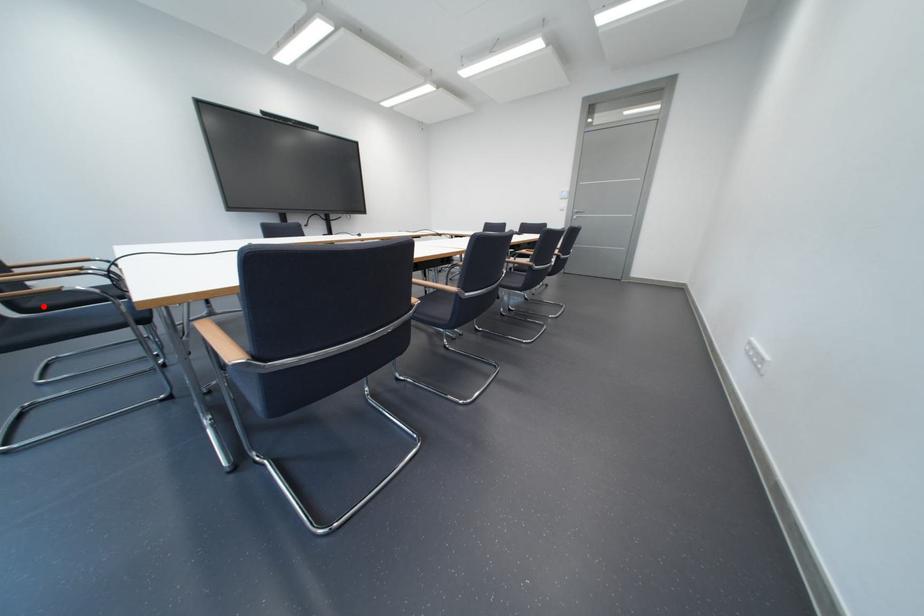
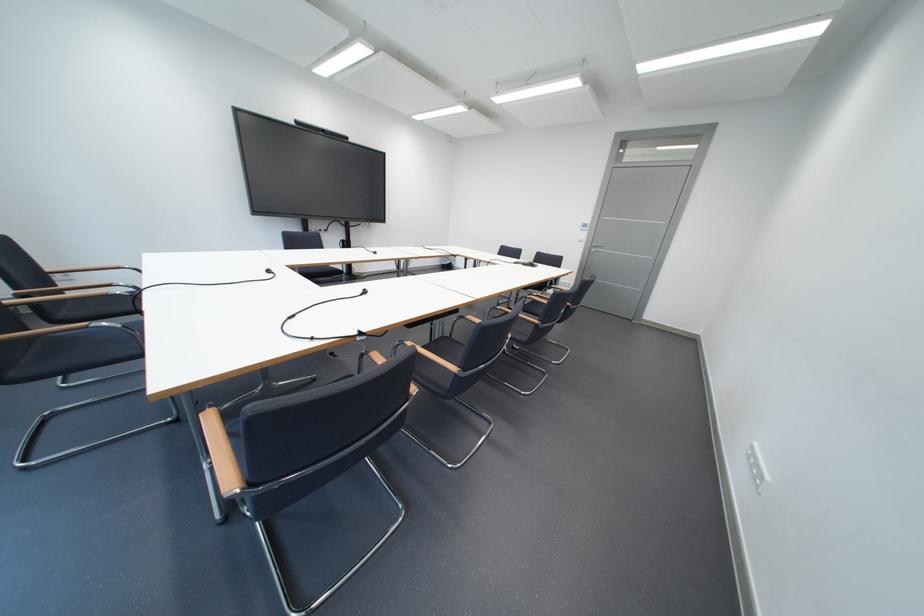
Find the pixel in the second image that matches the highlighted location in the first image.

(74, 317)